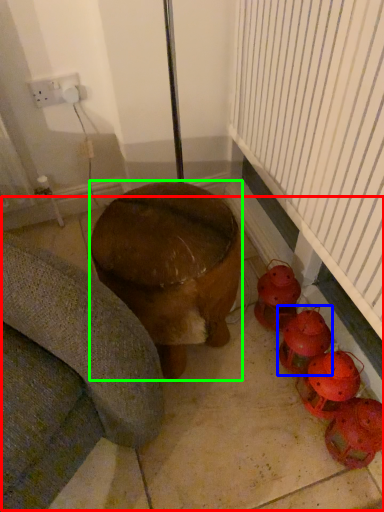
Question: Based on their relative distances, which object is farther from concrete (highlighted by a red box)? Choose from toy (highlighted by a blue box) and furniture (highlighted by a green box).

Choices:
 (A) toy
 (B) furniture

Answer: (B)